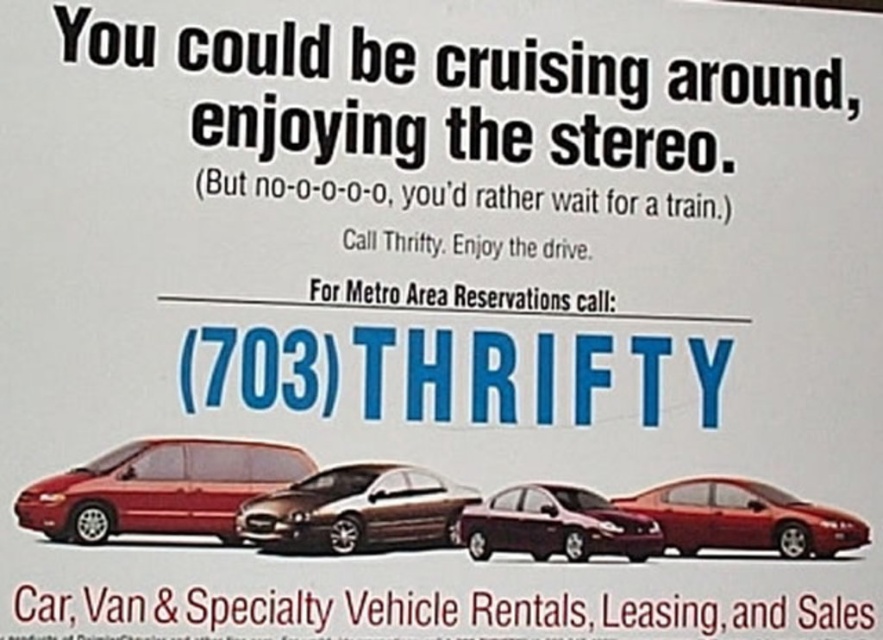
Question: Is matte red minivan at left above metallic brown sedan at center?

Choices:
 (A) no
 (B) yes

Answer: (B)

Question: Is matte red minivan at left wider than metallic brown sedan at center?

Choices:
 (A) no
 (B) yes

Answer: (B)

Question: Which point is closer to the camera taking this photo?

Choices:
 (A) (457, 493)
 (B) (494, 499)
 (C) (232, 522)

Answer: (C)

Question: Considering the real-world distances, which object is farthest from the glossy red car at lower right?

Choices:
 (A) satin burgundy sedan at center
 (B) matte red minivan at left

Answer: (B)

Question: Which point is closer to the camera taking this photo?

Choices:
 (A) (416, 515)
 (B) (586, 548)
 (C) (774, 532)

Answer: (A)

Question: Is matte red minivan at left positioned before glossy red car at lower right?

Choices:
 (A) no
 (B) yes

Answer: (B)